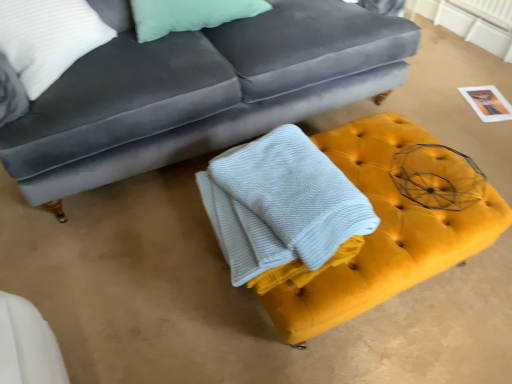
The width and height of the screenshot is (512, 384). What do you see at coordinates (283, 210) in the screenshot?
I see `white textured bath towel at center` at bounding box center [283, 210].

Where is `white textured pillow at upper left`? white textured pillow at upper left is located at coordinates (48, 38).

You are a GUI agent. You are given a task and a screenshot of the screen. Output one action in this format:
    pyautogui.click(x=<x>, y=<y>)
    Task: Click on the white textured bath towel at center
    The height and width of the screenshot is (384, 512).
    Given the screenshot: What is the action you would take?
    pyautogui.click(x=283, y=210)

Is yellow velvet ottoman at center oriented towards white textured bath towel at center?

No, yellow velvet ottoman at center is not facing towards white textured bath towel at center.

In the scene shown: Is yellow velvet ottoman at center not near white textured bath towel at center?

No, yellow velvet ottoman at center is in close proximity to white textured bath towel at center.

Considering the relative sizes of yellow velvet ottoman at center and white textured bath towel at center in the image provided, is yellow velvet ottoman at center thinner than white textured bath towel at center?

In fact, yellow velvet ottoman at center might be wider than white textured bath towel at center.

Which object is closer to the camera, yellow velvet ottoman at center or white textured bath towel at center?

white textured bath towel at center is closer to the camera.

Would you consider white textured pillow at upper left to be distant from yellow velvet ottoman at center?

Yes, white textured pillow at upper left and yellow velvet ottoman at center are located far from each other.

Could you tell me if white textured pillow at upper left is facing yellow velvet ottoman at center?

Yes, white textured pillow at upper left is oriented towards yellow velvet ottoman at center.

Between white textured pillow at upper left and yellow velvet ottoman at center, which one appears on the left side from the viewer's perspective?

white textured pillow at upper left is more to the left.

From a real-world perspective, is white textured pillow at upper left physically below yellow velvet ottoman at center?

No.

From the image's perspective, would you say white textured pillow at upper left is shown under white textured bath towel at center?

No, from the image's perspective, white textured pillow at upper left is not beneath white textured bath towel at center.

Can you confirm if white textured pillow at upper left is taller than white textured bath towel at center?

Yes, white textured pillow at upper left is taller than white textured bath towel at center.

Image resolution: width=512 pixels, height=384 pixels. I want to click on pillow above the white textured bath towel at center (from a real-world perspective), so click(48, 38).

Does point (45, 60) lie in front of point (243, 246)?

No, it is behind (243, 246).

From the image's perspective, does white textured pillow at upper left appear higher than velvet gray couch at upper center?

Incorrect, from the image's perspective, white textured pillow at upper left is lower than velvet gray couch at upper center.

Considering the sizes of objects white textured pillow at upper left and velvet gray couch at upper center in the image provided, who is shorter, white textured pillow at upper left or velvet gray couch at upper center?

Standing shorter between the two is white textured pillow at upper left.

Which object is further away from the camera taking this photo, white textured pillow at upper left or velvet gray couch at upper center?

white textured pillow at upper left is behind.

Considering the positions of points (102, 41) and (165, 76), is point (102, 41) farther from camera compared to point (165, 76)?

Yes.

Is yellow velvet ottoman at center positioned with its back to velvet gray couch at upper center?

yellow velvet ottoman at center is not turned away from velvet gray couch at upper center.

From a real-world perspective, is yellow velvet ottoman at center under velvet gray couch at upper center?

Yes, from a real-world perspective, yellow velvet ottoman at center is under velvet gray couch at upper center.

Which is more to the left, yellow velvet ottoman at center or velvet gray couch at upper center?

From the viewer's perspective, velvet gray couch at upper center appears more on the left side.

From the image's perspective, between white textured bath towel at center and white textured pillow at upper left, who is located below?

From the image's view, white textured bath towel at center is below.

In the image, there is a white textured pillow at upper left. Find the location of `bath towel below it (from the image's perspective)`. bath towel below it (from the image's perspective) is located at coordinates (283, 210).

Based on their positions, is white textured bath towel at center located to the left or right of white textured pillow at upper left?

Clearly, white textured bath towel at center is on the right of white textured pillow at upper left in the image.

Is point (289, 13) positioned in front of point (229, 192)?

No, (289, 13) is further to viewer.

Where is `bath towel located on the right of velvet gray couch at upper center`? Image resolution: width=512 pixels, height=384 pixels. bath towel located on the right of velvet gray couch at upper center is located at coordinates (283, 210).

Would you say velvet gray couch at upper center is a long distance from white textured bath towel at center?

No, velvet gray couch at upper center is in close proximity to white textured bath towel at center.

Is velvet gray couch at upper center surrounding white textured bath towel at center?

No, velvet gray couch at upper center does not contain white textured bath towel at center.

This screenshot has height=384, width=512. I want to click on the footrest below the white textured bath towel at center (from a real-world perspective), so coord(383,233).

Locate an element on the screen. The image size is (512, 384). pillow on the left of yellow velvet ottoman at center is located at coordinates click(48, 38).

Which object lies nearer to the anchor point white textured bath towel at center, yellow velvet ottoman at center or white textured pillow at upper left?

The object closer to white textured bath towel at center is yellow velvet ottoman at center.

Which object lies further to the anchor point white textured pillow at upper left, white textured bath towel at center or velvet gray couch at upper center?

white textured bath towel at center is further to white textured pillow at upper left.

Considering their positions, is white textured pillow at upper left positioned further to velvet gray couch at upper center than white textured bath towel at center?

white textured bath towel at center lies further to velvet gray couch at upper center than the other object.

Which object lies nearer to the anchor point white textured bath towel at center, white textured pillow at upper left or yellow velvet ottoman at center?

yellow velvet ottoman at center is closer to white textured bath towel at center.

When comparing their distances from white textured bath towel at center, does yellow velvet ottoman at center or velvet gray couch at upper center seem closer?

yellow velvet ottoman at center is closer to white textured bath towel at center.

Considering their positions, is white textured bath towel at center positioned closer to velvet gray couch at upper center than yellow velvet ottoman at center?

Among the two, white textured bath towel at center is located nearer to velvet gray couch at upper center.

Looking at this image, looking at the image, which one is located closer to white textured bath towel at center, white textured pillow at upper left or velvet gray couch at upper center?

Based on the image, velvet gray couch at upper center appears to be nearer to white textured bath towel at center.

Estimate the real-world distances between objects in this image. Which object is further from yellow velvet ottoman at center, white textured pillow at upper left or white textured bath towel at center?

white textured pillow at upper left.

I want to click on bath towel between white textured pillow at upper left and yellow velvet ottoman at center in the horizontal direction, so click(283, 210).

Identify the location of studio couch situated between white textured pillow at upper left and yellow velvet ottoman at center from left to right. (200, 92).

Where is `studio couch between white textured pillow at upper left and white textured bath towel at center from left to right`? Image resolution: width=512 pixels, height=384 pixels. studio couch between white textured pillow at upper left and white textured bath towel at center from left to right is located at coordinates (200, 92).

This screenshot has width=512, height=384. I want to click on bath towel between velvet gray couch at upper center and yellow velvet ottoman at center vertically, so click(x=283, y=210).